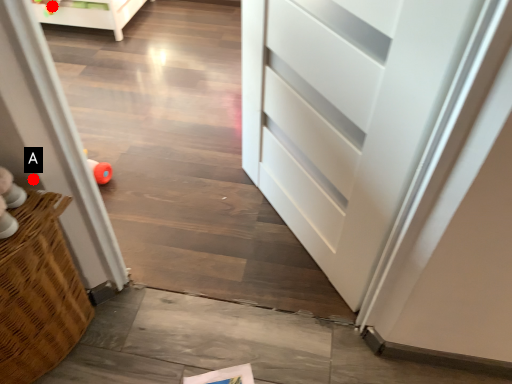
Question: Two points are circled on the image, labeled by A and B beside each circle. Which point appears closest to the camera in this image?

Choices:
 (A) A is closer
 (B) B is closer

Answer: (A)